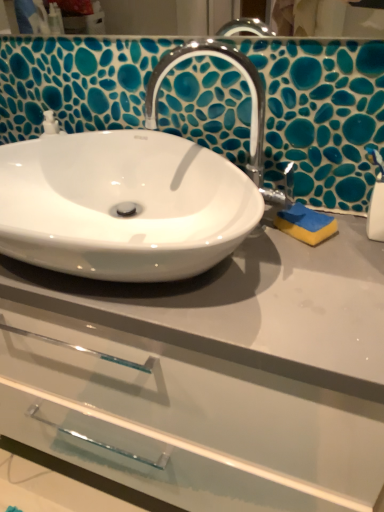
At what (x,y) coordinates should I click in order to perform the action: click on empty space that is to the right of chrome/polished metal faucet at center. Please return your answer as a coordinate pair (x, y). This screenshot has height=512, width=384. Looking at the image, I should click on (325, 240).